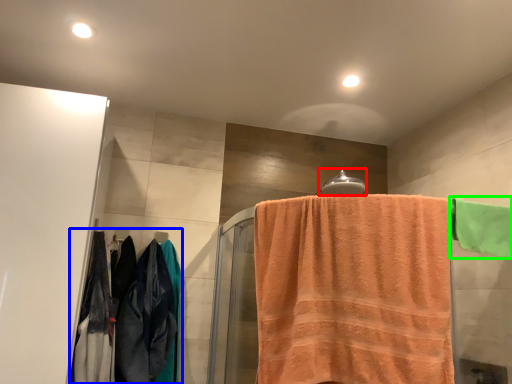
Question: Based on their relative distances, which object is farther from towel bar (highlighted by a red box)? Choose from clothing (highlighted by a blue box) and towel (highlighted by a green box).

Choices:
 (A) clothing
 (B) towel

Answer: (A)